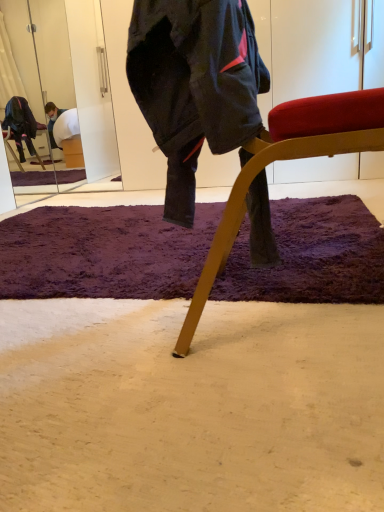
What do you see at coordinates (194, 85) in the screenshot? I see `dark blue fabric jacket at center` at bounding box center [194, 85].

Describe the element at coordinates (103, 252) in the screenshot. I see `purple shaggy rug at center` at that location.

Image resolution: width=384 pixels, height=512 pixels. Describe the element at coordinates (286, 160) in the screenshot. I see `wooden chair at center` at that location.

You are a GUI agent. You are given a task and a screenshot of the screen. Output one action in this format:
    pyautogui.click(x=<x>, y=<y>)
    Task: Click on the dark blue fabric jacket at center
    The width and height of the screenshot is (384, 512).
    Given the screenshot: What is the action you would take?
    pyautogui.click(x=194, y=85)

Looking at this image, is dark blue fabric jacket at center to the right of wooden chair at center from the viewer's perspective?

No, dark blue fabric jacket at center is not to the right of wooden chair at center.

Can you confirm if dark blue fabric jacket at center is shorter than wooden chair at center?

Yes, dark blue fabric jacket at center is shorter than wooden chair at center.

Which of these two, purple shaggy rug at center or dark blue fabric jacket at center, is thinner?

dark blue fabric jacket at center is thinner.

Considering the relative positions of purple shaggy rug at center and dark blue fabric jacket at center in the image provided, is purple shaggy rug at center to the left of dark blue fabric jacket at center from the viewer's perspective?

Yes.

What's the angular difference between purple shaggy rug at center and dark blue fabric jacket at center's facing directions?

The facing directions of purple shaggy rug at center and dark blue fabric jacket at center are 92 degrees apart.

Which object is more forward, purple shaggy rug at center or dark blue fabric jacket at center?

dark blue fabric jacket at center is closer to the camera.

Is wooden chair at center positioned far away from purple shaggy rug at center?

No, wooden chair at center is not far away from purple shaggy rug at center.

Is wooden chair at center wider than purple shaggy rug at center?

No.

In the scene shown: From a real-world perspective, is wooden chair at center on purple shaggy rug at center?

Yes, from a real-world perspective, wooden chair at center is on top of purple shaggy rug at center.

Does point (358, 207) come farther from viewer compared to point (305, 127)?

Yes.

Looking at the image, does purple shaggy rug at center seem bigger or smaller compared to wooden chair at center?

Clearly, purple shaggy rug at center is smaller in size than wooden chair at center.

Based on the photo, is purple shaggy rug at center surrounding wooden chair at center?

That's incorrect, wooden chair at center is not inside purple shaggy rug at center.

How different are the orientations of purple shaggy rug at center and wooden chair at center in degrees?

92 degrees.

Between wooden chair at center and dark blue fabric jacket at center, which one has smaller size?

dark blue fabric jacket at center.

Relative to dark blue fabric jacket at center, is wooden chair at center in front or behind?

Visually, wooden chair at center is located in front of dark blue fabric jacket at center.

From a real-world perspective, who is located higher, wooden chair at center or dark blue fabric jacket at center?

dark blue fabric jacket at center, from a real-world perspective.

What's the angular difference between wooden chair at center and dark blue fabric jacket at center's facing directions?

They differ by 0.000307 degrees in their facing directions.

In the scene shown: Between dark blue fabric jacket at center and purple shaggy rug at center, which one appears on the left side from the viewer's perspective?

From the viewer's perspective, purple shaggy rug at center appears more on the left side.

From a real-world perspective, which object rests below the other?

purple shaggy rug at center.

Is dark blue fabric jacket at center located outside purple shaggy rug at center?

Yes, dark blue fabric jacket at center is located beyond the bounds of purple shaggy rug at center.

Does dark blue fabric jacket at center come behind purple shaggy rug at center?

No.

Where is `person on the left of wooden chair at center`? person on the left of wooden chair at center is located at coordinates (194, 85).

The height and width of the screenshot is (512, 384). Find the location of `person above the purple shaggy rug at center (from a real-world perspective)`. person above the purple shaggy rug at center (from a real-world perspective) is located at coordinates pos(194,85).

Based on their spatial positions, is dark blue fabric jacket at center or purple shaggy rug at center closer to wooden chair at center?

dark blue fabric jacket at center is closer to wooden chair at center.

Looking at the image, which one is located further to purple shaggy rug at center, wooden chair at center or dark blue fabric jacket at center?

dark blue fabric jacket at center is further to purple shaggy rug at center.

Looking at the image, which one is located further to dark blue fabric jacket at center, wooden chair at center or purple shaggy rug at center?

The object further to dark blue fabric jacket at center is purple shaggy rug at center.

Considering their positions, is purple shaggy rug at center positioned closer to dark blue fabric jacket at center than wooden chair at center?

Among the two, wooden chair at center is located nearer to dark blue fabric jacket at center.

Which object lies further to the anchor point purple shaggy rug at center, dark blue fabric jacket at center or wooden chair at center?

Based on the image, dark blue fabric jacket at center appears to be further to purple shaggy rug at center.

Based on their spatial positions, is purple shaggy rug at center or dark blue fabric jacket at center closer to wooden chair at center?

dark blue fabric jacket at center is closer to wooden chair at center.

This screenshot has height=512, width=384. Identify the location of person located between wooden chair at center and purple shaggy rug at center in the depth direction. (194, 85).